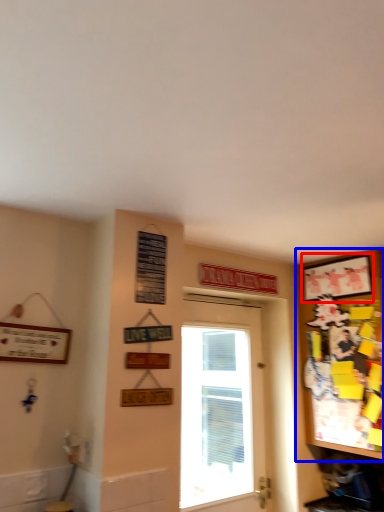
Question: Which object appears farthest to the camera in this image, picture frame (highlighted by a red box) or cabinetry (highlighted by a blue box)?

Choices:
 (A) picture frame
 (B) cabinetry

Answer: (A)